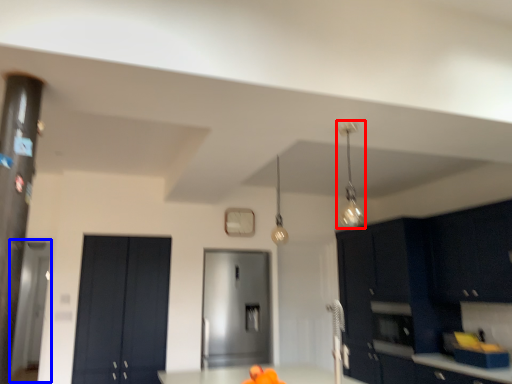
Question: Which point is closer to the camera, light fixture (highlighted by a red box) or glass door (highlighted by a blue box)?

Choices:
 (A) light fixture
 (B) glass door

Answer: (A)